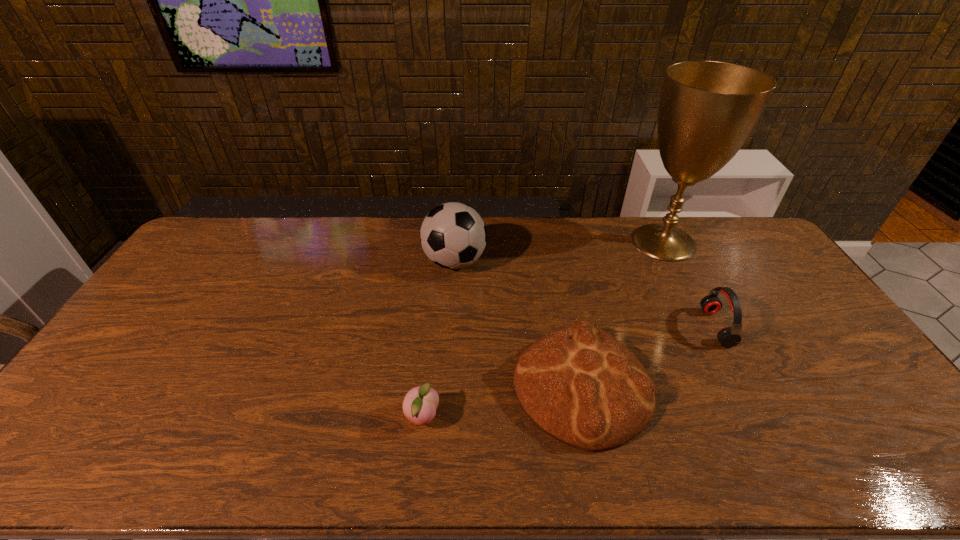
At what (x,y) coordinates should I click in order to perform the action: click on the third closest object to the third object from right to left. Please return your answer as a coordinate pair (x, y). The image size is (960, 540). Looking at the image, I should click on (453, 235).

Locate an element on the screen. object that is the third nearest to the third object from right to left is located at coordinates (453, 235).

What are the coordinates of `vacant space that satisfies the following two spatial constraints: 1. on the back side of the shortest object; 2. on the left side of the trophy cup` in the screenshot? It's located at (442, 242).

Identify the location of free location that satisfies the following two spatial constraints: 1. on the back side of the third object from left to right; 2. on the left side of the peach. (425, 387).